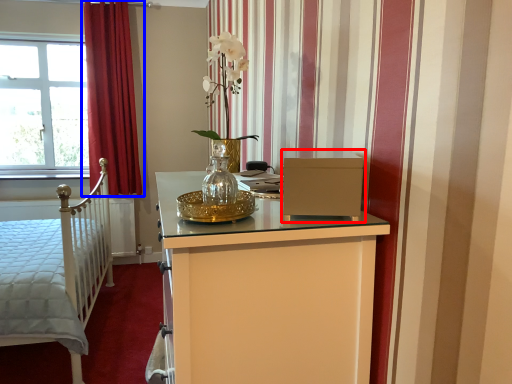
Question: Which object is closer to the camera taking this photo, file cabinet (highlighted by a red box) or curtain (highlighted by a blue box)?

Choices:
 (A) file cabinet
 (B) curtain

Answer: (A)